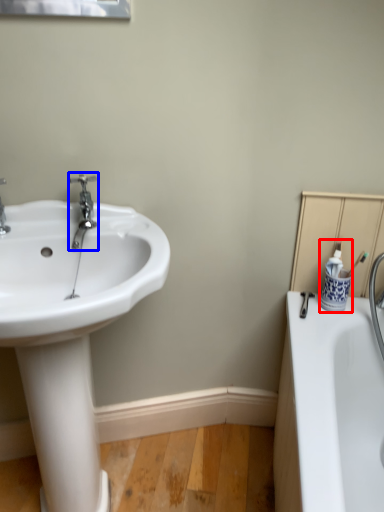
Question: Which object appears closest to the camera in this image, toiletry (highlighted by a red box) or tap (highlighted by a blue box)?

Choices:
 (A) toiletry
 (B) tap

Answer: (B)